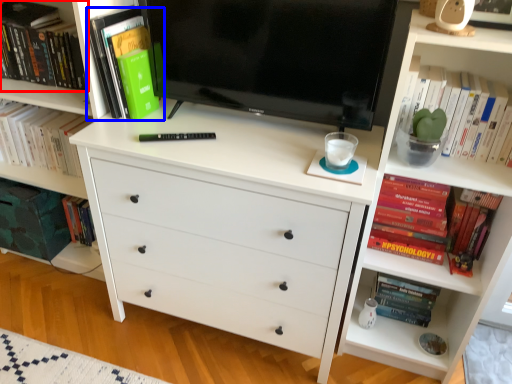
Question: Which of the following is the farthest to the observer, book (highlighted by a red box) or book (highlighted by a blue box)?

Choices:
 (A) book
 (B) book

Answer: (A)